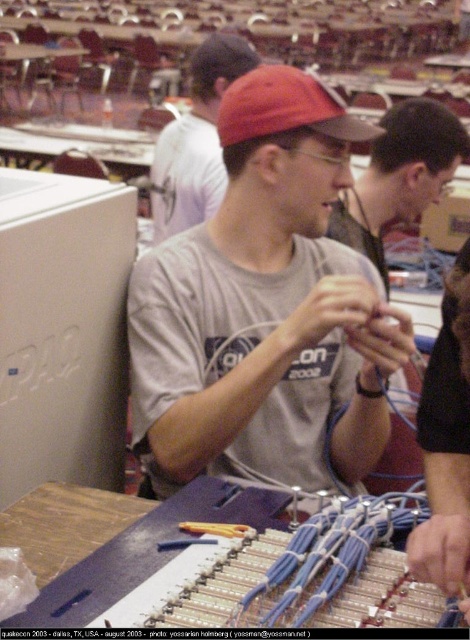
Question: Which is farther from the matte gray t-shirt at center?

Choices:
 (A) red matte cap at center
 (B) white plastic computer at left

Answer: (B)

Question: Is white plastic computer at left positioned before matte gray t-shirt at center?

Choices:
 (A) no
 (B) yes

Answer: (B)

Question: Based on their relative distances, which object is farther from the red matte cap at center?

Choices:
 (A) gray cotton t-shirt at center
 (B) white plastic computer at left

Answer: (B)

Question: Does gray cotton t-shirt at center have a lesser width compared to red matte cap at center?

Choices:
 (A) no
 (B) yes

Answer: (A)

Question: Among these points, which one is nearest to the camera?

Choices:
 (A) (0, 474)
 (B) (241, 100)
 (C) (169, 141)

Answer: (A)

Question: Is gray cotton t-shirt at center wider than white plastic computer at left?

Choices:
 (A) yes
 (B) no

Answer: (A)